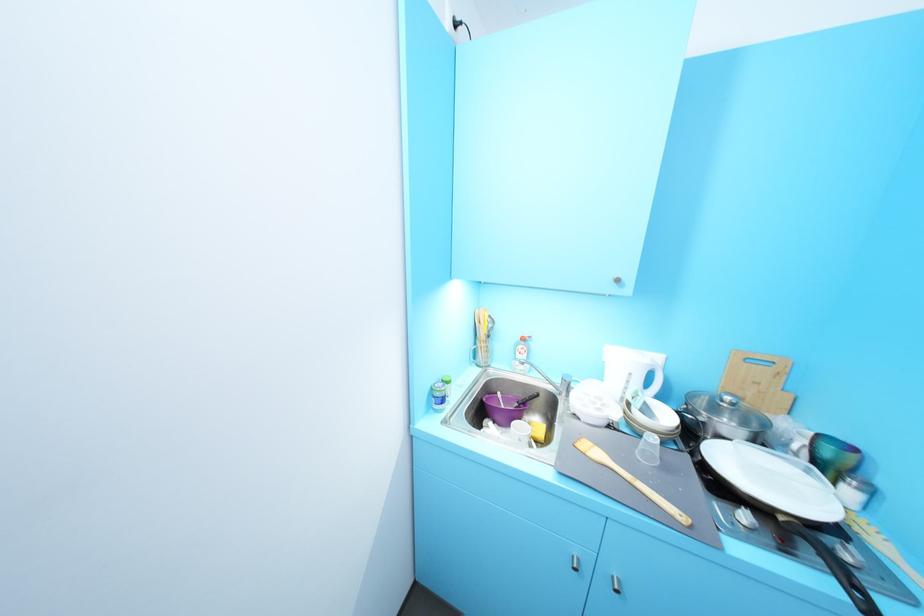
This screenshot has height=616, width=924. What do you see at coordinates (538, 371) in the screenshot?
I see `a sink faucet handle` at bounding box center [538, 371].